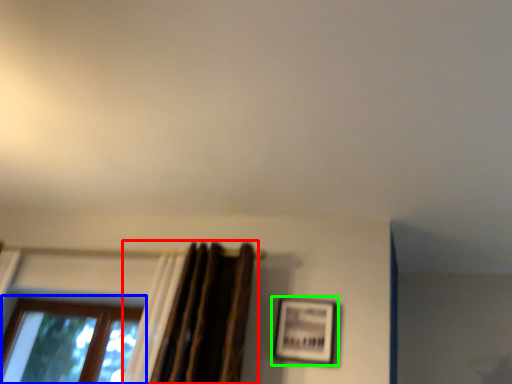
Question: Estimate the real-world distances between objects in this image. Which object is closer to curtain (highlighted by a red box), window (highlighted by a blue box) or picture frame (highlighted by a green box)?

Choices:
 (A) window
 (B) picture frame

Answer: (B)